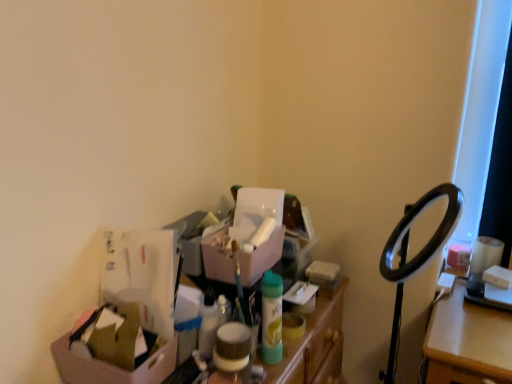
You are a GUI agent. You are given a task and a screenshot of the screen. Output one action in this format:
    pyautogui.click(x=<x>, y=<y>)
    Task: Click on the empty space that is ontop of cardboard box at lower left, the first box in the bottom-to-top sequence (from a real-world perspective)
    
    Given the screenshot: What is the action you would take?
    pyautogui.click(x=118, y=342)